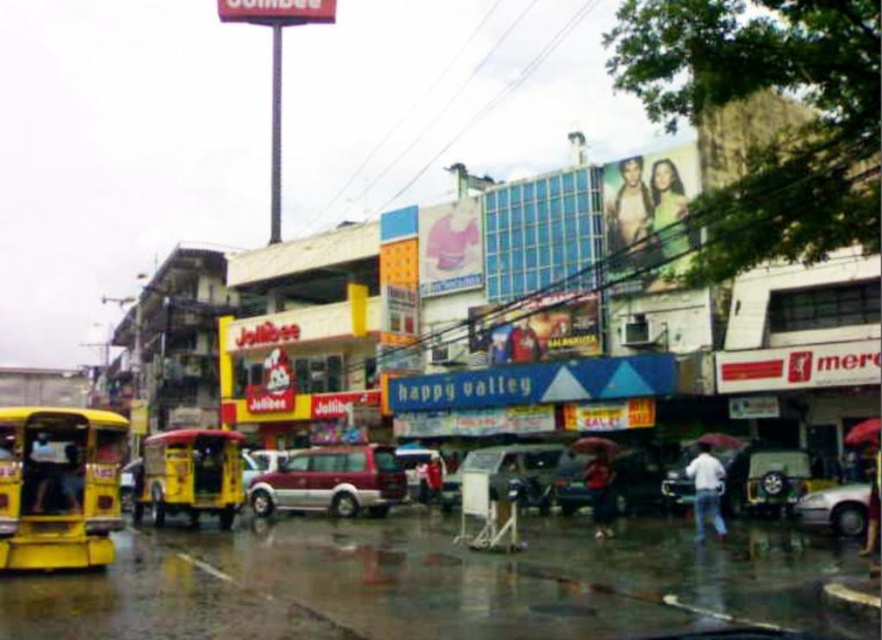
You are standing on the street and see two points marked on the wet pavement. Which point is closer to you, the point at coordinate (876, 448) or the point at coordinate (595, 448)?

The point at coordinate (876, 448) is closer to the viewer than the point at coordinate (595, 448).

You are standing on the bustling urban street and want to take a photo that includes both the point at coordinates point (80, 420) and point (872, 474). Since one is closer to you, will you need to adjust your camera angle to include both in the frame?

Yes, you will need to adjust your camera angle because point (80, 420) is closer to the camera than point (872, 474). To include both in the frame, you might need to tilt or reposition the camera to account for their different distances from the viewer.